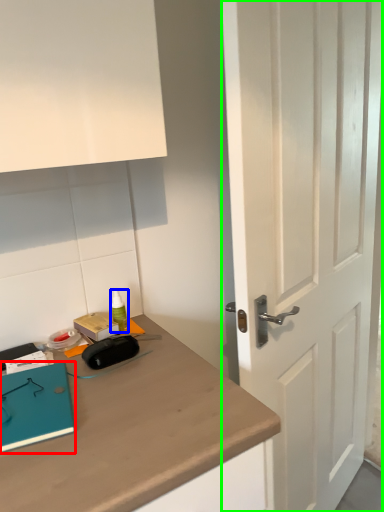
Question: Which object is the closest to the notebook (highlighted by a red box)? Choose among these: stationery (highlighted by a blue box) or door (highlighted by a green box).

Choices:
 (A) stationery
 (B) door

Answer: (A)